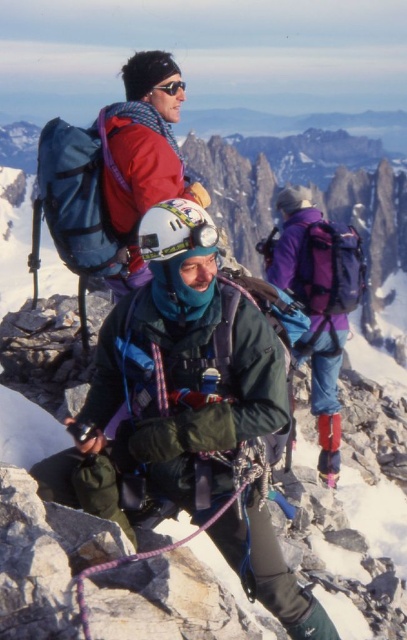
You are a photographer positioned at the base of the mountain. You want to capture a photo of the climber in the green fabric jacket at center and the matte black goggles at upper center. Which object should you focus on first if you want to include both in the frame without moving the camera?

You should focus on the green fabric jacket at center first because it is to the left of the matte black goggles at upper center, so adjusting the frame to include both would require ensuring the leftmost object is within the camera view first.

You are a mountain guide planning a route for climbers. You need to ensure that the green fabric jacket at center is visible from the starting point. Is the point at coordinates (172, 380) obstructed by any rocks or other climbers?

The green fabric jacket at center is located at point (172, 380), so it is not obstructed by any rocks or other climbers.

You are a photographer on the mountain and want to capture a photo of the green fabric jacket at center and the matte black goggles at upper center. Which object should you focus on first if you want to ensure both are in sharp focus?

The green fabric jacket at center is taller than matte black goggles at upper center, so you should focus on the green fabric jacket at center first to ensure both are in sharp focus.